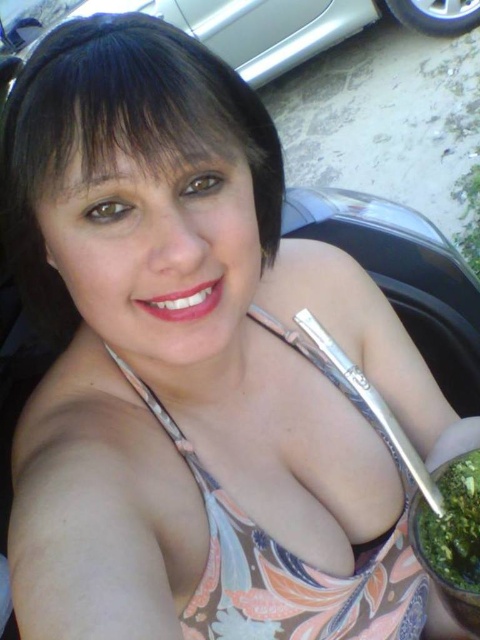
Between silver metallic car at upper center and green leafy substance at lower right, which one appears on the right side from the viewer's perspective?

green leafy substance at lower right is more to the right.

Which is in front, point (257, 12) or point (448, 472)?

Positioned in front is point (448, 472).

Which is in front, point (233, 20) or point (468, 593)?

Point (468, 593)

At what (x,y) coordinates should I click in order to perform the action: click on silver metallic car at upper center. Please return your answer as a coordinate pair (x, y). Image resolution: width=480 pixels, height=640 pixels. Looking at the image, I should click on [x=206, y=28].

Looking at this image, between floral print bikini top at center and green leafy substance at lower right, which one is positioned higher?

green leafy substance at lower right

Which of these two, floral print bikini top at center or green leafy substance at lower right, stands shorter?

green leafy substance at lower right is shorter.

The height and width of the screenshot is (640, 480). I want to click on floral print bikini top at center, so click(291, 554).

Identify the location of floral print bikini top at center. The height and width of the screenshot is (640, 480). (291, 554).

Can you confirm if floral print bikini top at center is thinner than silver metallic car at upper center?

Correct, floral print bikini top at center's width is less than silver metallic car at upper center's.

Who is taller, floral print bikini top at center or silver metallic car at upper center?

silver metallic car at upper center

Where is `floral print bikini top at center`? floral print bikini top at center is located at coordinates (291, 554).

The image size is (480, 640). I want to click on floral print bikini top at center, so click(x=291, y=554).